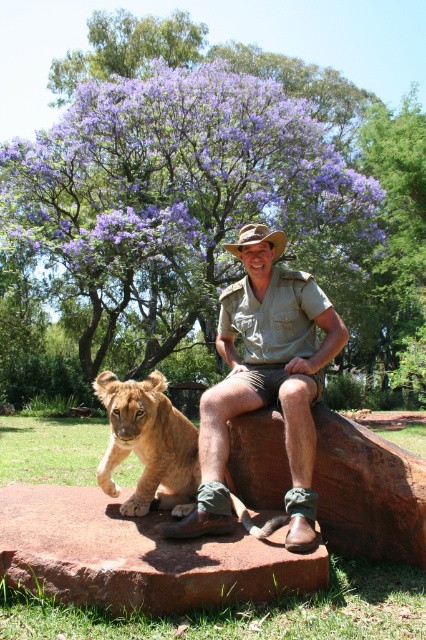
Question: Which point is farther to the camera?

Choices:
 (A) 206,506
 (B) 141,410
 (C) 270,163
 (D) 141,592

Answer: (C)

Question: Can you confirm if purple leafy tree at upper center is positioned above green canvas shirt at center?

Choices:
 (A) no
 (B) yes

Answer: (B)

Question: Among these objects, which one is nearest to the camera?

Choices:
 (A) purple leafy tree at upper center
 (B) brown stone at lower center

Answer: (B)

Question: From the image, what is the correct spatial relationship of purple leafy tree at upper center in relation to golden fur cub at lower left?

Choices:
 (A) left
 (B) right

Answer: (B)

Question: Is purple leafy tree at upper center positioned before brown stone at lower center?

Choices:
 (A) yes
 (B) no

Answer: (B)

Question: Among these objects, which one is farthest from the camera?

Choices:
 (A) green canvas shirt at center
 (B) purple leafy tree at upper center
 (C) brown stone at lower center

Answer: (B)